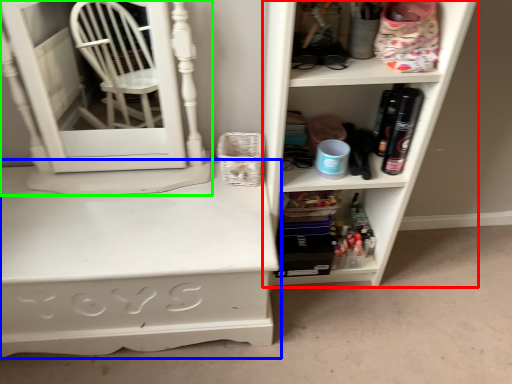
Question: Which object is the farthest from shelf (highlighted by a red box)? Choose among these: desk (highlighted by a blue box) or medicine cabinet (highlighted by a green box).

Choices:
 (A) desk
 (B) medicine cabinet

Answer: (B)